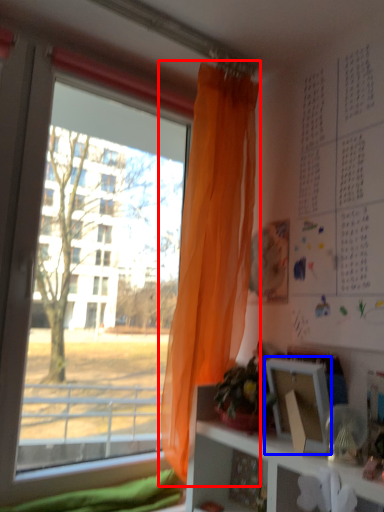
Question: Which object appears farthest to the camera in this image, curtain (highlighted by a red box) or picture frame (highlighted by a blue box)?

Choices:
 (A) curtain
 (B) picture frame

Answer: (A)